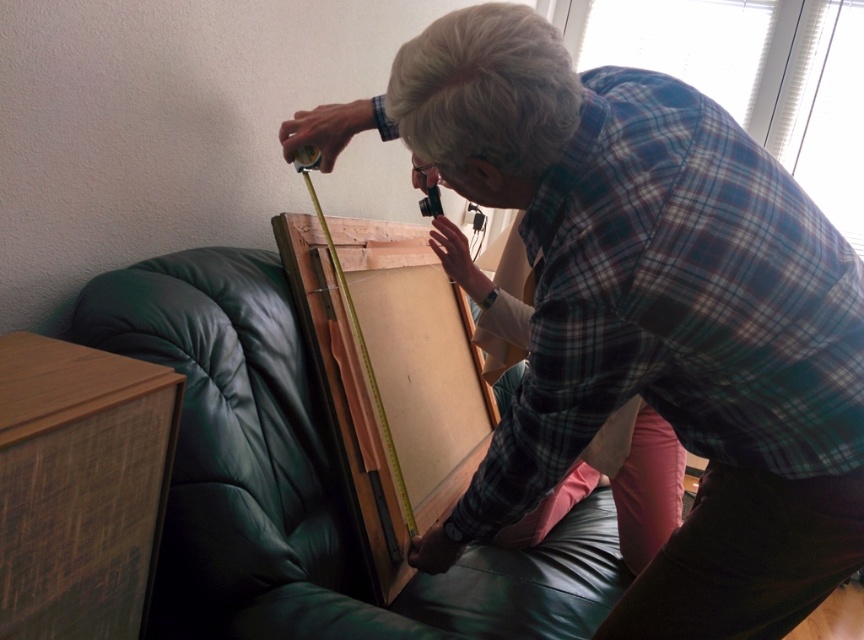
Question: Can you confirm if wooden at left is positioned below wooden paint brush at center?

Choices:
 (A) yes
 (B) no

Answer: (A)

Question: Based on their relative distances, which object is farther from the green leather couch at center?

Choices:
 (A) wooden at left
 (B) wooden paint brush at center
 (C) matte plaid shirt at center

Answer: (C)

Question: Which object is farther from the camera taking this photo?

Choices:
 (A) matte plaid shirt at center
 (B) wooden at left
 (C) green leather couch at center

Answer: (B)

Question: In this image, where is green leather couch at center located relative to brown woven wood at lower left?

Choices:
 (A) above
 (B) below

Answer: (B)

Question: Does matte plaid shirt at center have a greater width compared to wooden paint brush at center?

Choices:
 (A) no
 (B) yes

Answer: (B)

Question: Among these objects, which one is nearest to the camera?

Choices:
 (A) brown woven wood at lower left
 (B) green leather couch at center

Answer: (A)